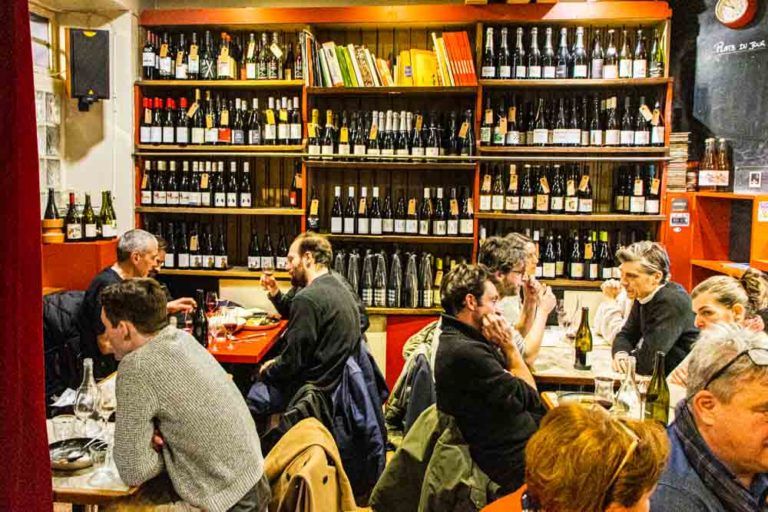
Locate an element on the screen. Image resolution: width=768 pixels, height=512 pixels. wall is located at coordinates (743, 111).